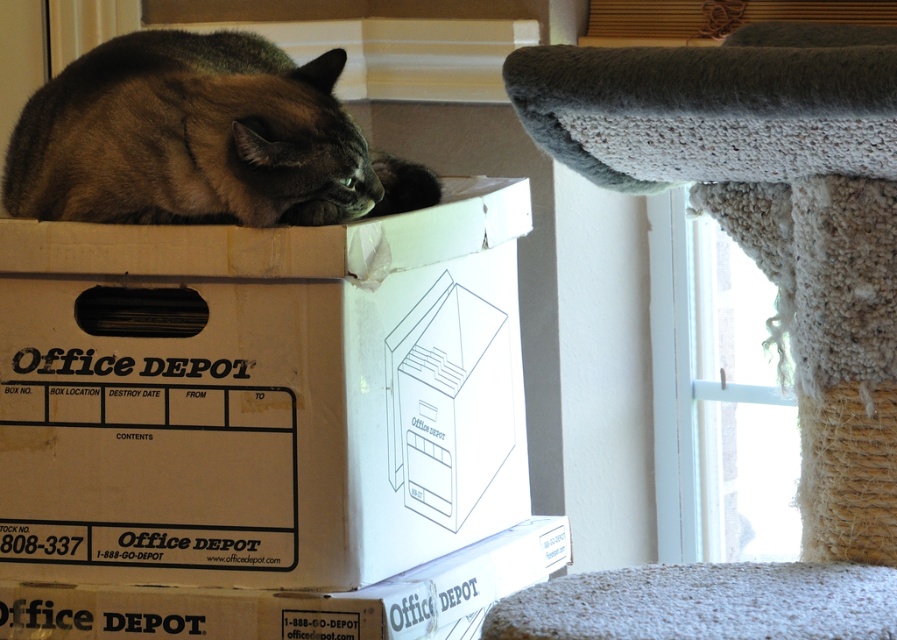
You are a delivery person who just arrived at the house. You see the white cardboard box at center and the textured gray carpet at lower right. Which object is closer to you?

The white cardboard box at center is closer to you because the textured gray carpet at lower right is behind it.

You are organizing boxes in a storage room and need to place a new box between the white cardboard box at center and the matte brown cardboard box at center. Based on their positions, where should you place the new box?

The white cardboard box at center is to the left of the matte brown cardboard box at center, so you should place the new box between them to the right of the white cardboard box at center and to the left of the matte brown cardboard box at center.